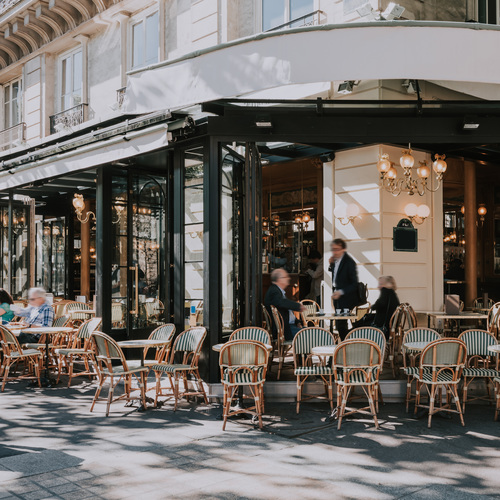
At what (x,y) coordinates should I click in order to perform the action: click on window. Please return your answer as a coordinate pair (x, y). Looking at the image, I should click on (15, 102), (74, 89), (145, 40), (297, 11).